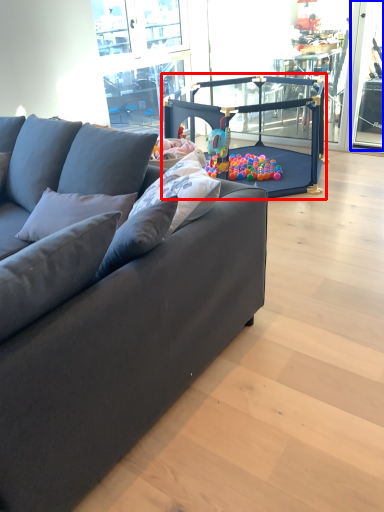
Question: Which of the following is the farthest to the observer, baby carriage (highlighted by a red box) or window screen (highlighted by a blue box)?

Choices:
 (A) baby carriage
 (B) window screen

Answer: (B)